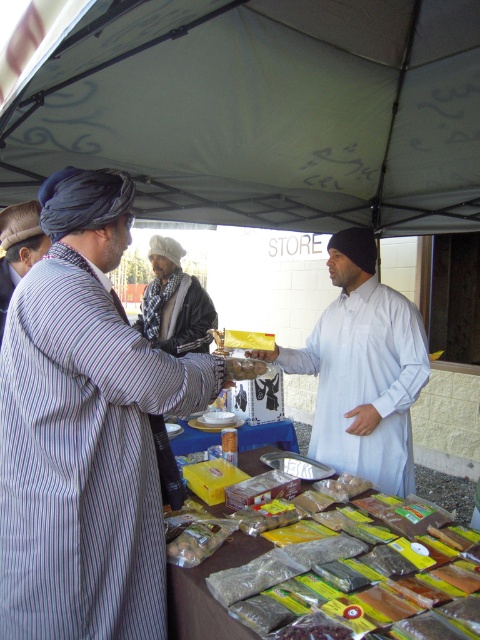
You are a customer at this market stall. You want to pick up the striped fabric coat at left and the brown matte nuts at center. How far apart are these items?

The striped fabric coat at left and brown matte nuts at center are 41.54 centimeters apart.

You are standing at the entrance of the store and see two points of interest in the market scene. The first point is at coordinate point (x=162, y=312) and the second is at point (x=8, y=224). Which point is closer to you?

Point (x=162, y=312) is closer to you because it is further to the viewer than point (x=8, y=224).

What is the position of the white woolen turban at center in the image?

The white woolen turban at center is located at point coordinates of 0.473 on the x axis and 0.365 on the y axis.